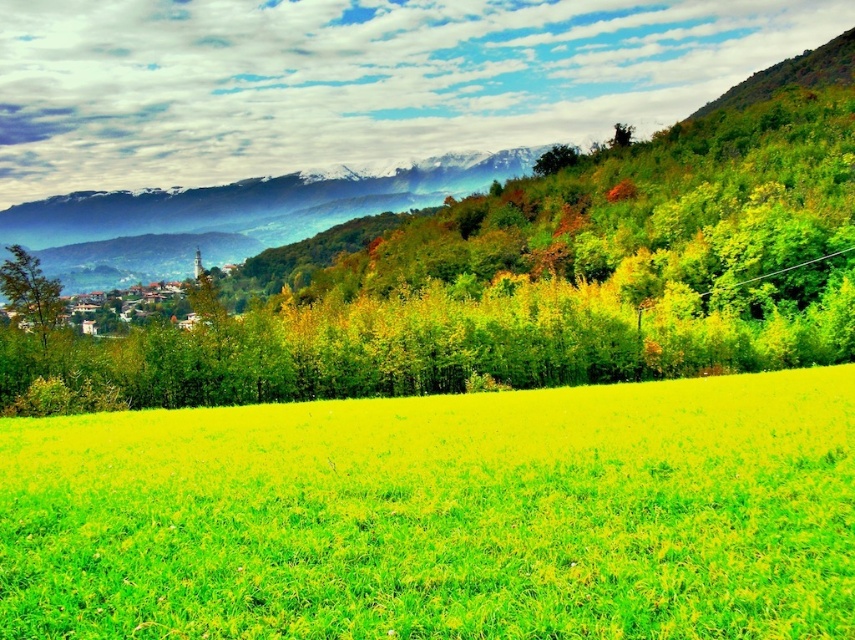
Who is taller, bright green grass at center or green matte tree at left?

With more height is green matte tree at left.

How much distance is there between bright green grass at center and green matte tree at left?

A distance of 108.78 feet exists between bright green grass at center and green matte tree at left.

Between point (3, 564) and point (16, 310), which one is positioned in front?

Positioned in front is point (3, 564).

Locate an element on the screen. The height and width of the screenshot is (640, 855). bright green grass at center is located at coordinates (441, 515).